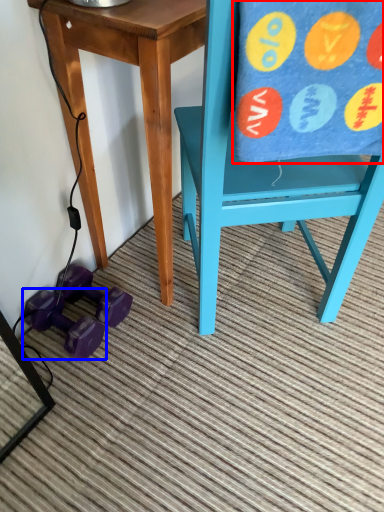
Question: Which of the following is the closest to the observer, beach towel (highlighted by a red box) or dumbbell (highlighted by a blue box)?

Choices:
 (A) beach towel
 (B) dumbbell

Answer: (A)